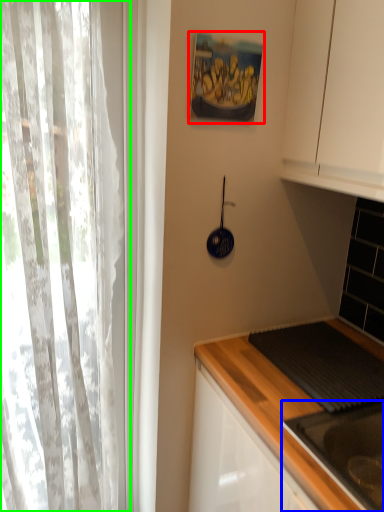
Question: Which object is positioned closest to picture frame (highlighted by a red box)? Select from sink (highlighted by a blue box) and curtain (highlighted by a green box).

Choices:
 (A) sink
 (B) curtain

Answer: (B)